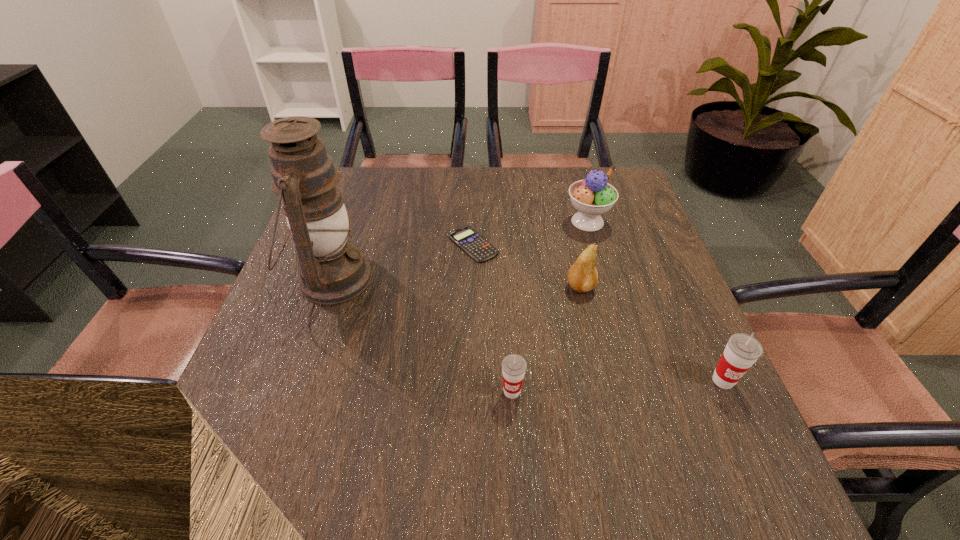
This screenshot has width=960, height=540. Identify the location of vacant region between the calculator and the left cup. (492, 318).

In order to click on empty space between the oil lamp and the icecream in this screenshot , I will do `click(460, 250)`.

In order to click on vacant region between the right cup and the shortest object in this screenshot , I will do `click(598, 312)`.

Where is `empty location between the shorter cup and the calculator`? empty location between the shorter cup and the calculator is located at coordinates (492, 318).

I want to click on vacant space that is in between the shorter cup and the taller cup, so click(617, 386).

Identify which object is the third closest to the pear. Please provide its 2D coordinates. Your answer should be formatted as a tuple, i.e. [(x, y)], where the tuple contains the x and y coordinates of a point satisfying the conditions above.

[(514, 366)]

Identify which object is the third nearest to the taller cup. Please provide its 2D coordinates. Your answer should be formatted as a tuple, i.e. [(x, y)], where the tuple contains the x and y coordinates of a point satisfying the conditions above.

[(593, 196)]

This screenshot has width=960, height=540. I want to click on free point that satisfies the following two spatial constraints: 1. on the front side of the pear; 2. on the right side of the calculator, so click(x=471, y=288).